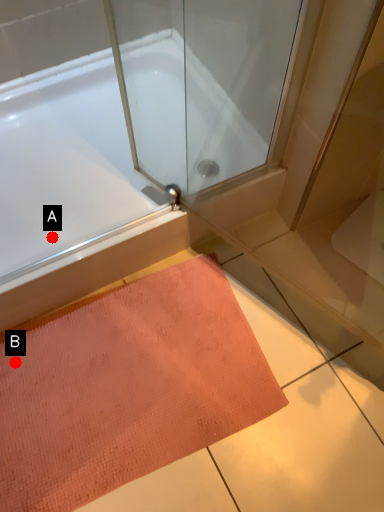
Question: Two points are circled on the image, labeled by A and B beside each circle. Which point is farther to the camera?

Choices:
 (A) A is further
 (B) B is further

Answer: (A)